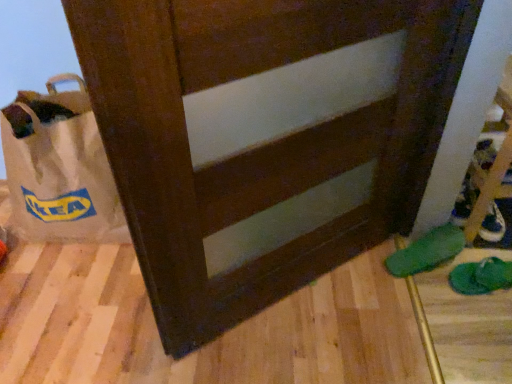
Question: From their relative heights in the image, would you say green fabric slipper at lower right, which is counted as the first footwear, starting from the left, is taller or shorter than green fabric slipper at lower right, positioned as the 1th footwear in right-to-left order?

Choices:
 (A) tall
 (B) short

Answer: (A)

Question: In the image, is green fabric slipper at lower right, the second footwear from the right, on the left side or the right side of green fabric slipper at lower right, positioned as the 1th footwear in right-to-left order?

Choices:
 (A) right
 (B) left

Answer: (B)

Question: Estimate the real-world distances between objects in this image. Which object is farther from the green fabric slipper at lower right, acting as the second footwear starting from the left?

Choices:
 (A) white paper bag at left
 (B) white leather shoe at lower right
 (C) green fabric slipper at lower right, which is counted as the first footwear, starting from the left

Answer: (A)

Question: Based on their relative distances, which object is farther from the green fabric slipper at lower right, which is counted as the first footwear, starting from the left?

Choices:
 (A) green fabric slipper at lower right, acting as the second footwear starting from the left
 (B) white paper bag at left
 (C) white leather shoe at lower right

Answer: (B)